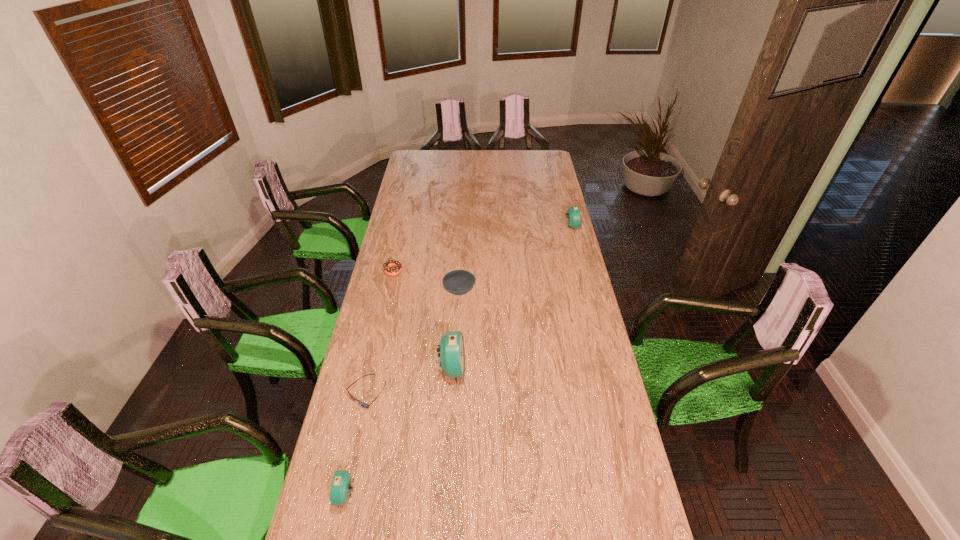
Find the location of a particular element. This screenshot has width=960, height=540. free space located 0.050m on the front-facing side of the leftmost alarm clock is located at coordinates (319, 495).

This screenshot has width=960, height=540. I want to click on free space located 0.400m on the front-facing side of the tallest object, so click(x=575, y=369).

The image size is (960, 540). In order to click on vacant area located at the front of the sunglasses showing the lenses in this screenshot , I will do `click(352, 457)`.

You are a GUI agent. You are given a task and a screenshot of the screen. Output one action in this format:
    pyautogui.click(x=<x>, y=<y>)
    Task: Click on the vacant space located 0.110m on the left of the bowl
    This screenshot has height=540, width=960.
    Given the screenshot: What is the action you would take?
    pyautogui.click(x=418, y=291)

I want to click on vacant space located on the back of the fifth nearest object, so click(401, 233).

Where is `object located in the near edge section of the desktop`? object located in the near edge section of the desktop is located at coordinates (341, 484).

You are a GUI agent. You are given a task and a screenshot of the screen. Output one action in this format:
    pyautogui.click(x=<x>, y=<y>)
    Task: Click on the alarm clock that is at the left edge
    
    Given the screenshot: What is the action you would take?
    pyautogui.click(x=341, y=484)

Where is `sunglasses at the left edge`? The width and height of the screenshot is (960, 540). sunglasses at the left edge is located at coordinates (365, 405).

Locate an element on the screen. The height and width of the screenshot is (540, 960). doughnut positioned at the left edge is located at coordinates (387, 265).

What are the coordinates of `object present at the right edge` in the screenshot? It's located at (573, 213).